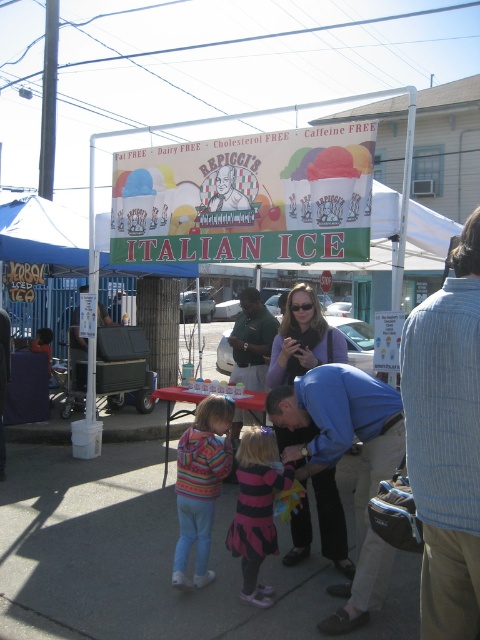
Does point (312, 333) lie in front of point (225, 435)?

No, it is behind (225, 435).

Looking at this image, is matte purple sweater at center in front of striped sweater at center?

No, matte purple sweater at center is further to the viewer.

At what (x,y) coordinates should I click in order to perform the action: click on matte purple sweater at center. Please return your answer as a coordinate pair (x, y). The width and height of the screenshot is (480, 640). Looking at the image, I should click on (302, 339).

Can you confirm if matte purple sweater at center is positioned to the right of blue jeans at lower left?

Correct, you'll find matte purple sweater at center to the right of blue jeans at lower left.

Does matte purple sweater at center lie behind blue jeans at lower left?

No, it is in front of blue jeans at lower left.

This screenshot has width=480, height=640. What are the coordinates of `matte purple sweater at center` in the screenshot? It's located at (302, 339).

Can you confirm if striped sweater at center is taller than striped fabric dress at center?

Yes, striped sweater at center is taller than striped fabric dress at center.

Does point (201, 540) come in front of point (241, 596)?

No.

Who is more distant from viewer, [193,426] or [268,516]?

Point [193,426]

Find the location of a particular element. This screenshot has width=480, height=640. striped sweater at center is located at coordinates (201, 484).